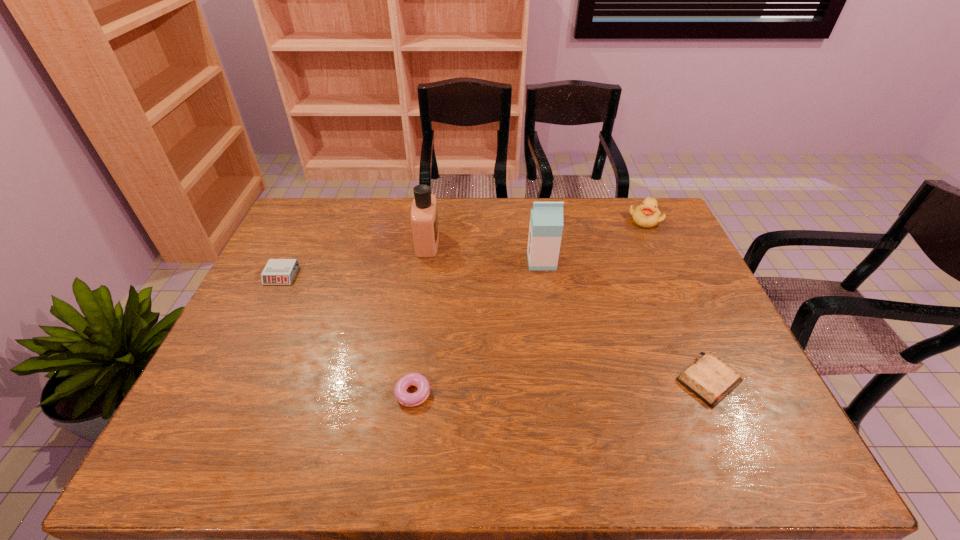
At what (x,y) coordinates should I click in order to perform the action: click on free space that satisfies the following two spatial constraints: 1. on the front label of the perfume; 2. on the left side of the fourth object from left to right. Please return your answer as a coordinate pair (x, y). The image size is (960, 540). Looking at the image, I should click on (425, 261).

Image resolution: width=960 pixels, height=540 pixels. What are the coordinates of `vacant space that satisfies the following two spatial constraints: 1. on the front label of the perfume; 2. on the left side of the diary` in the screenshot? It's located at (408, 380).

The width and height of the screenshot is (960, 540). I want to click on vacant region that satisfies the following two spatial constraints: 1. on the back side of the diary; 2. on the front label of the perfume, so click(648, 243).

Where is `free location that satisfies the following two spatial constraints: 1. on the front-facing side of the farthest object; 2. on the front label of the perfume`? The width and height of the screenshot is (960, 540). free location that satisfies the following two spatial constraints: 1. on the front-facing side of the farthest object; 2. on the front label of the perfume is located at coordinates (656, 243).

Where is `vacant space that satisfies the following two spatial constraints: 1. on the back side of the doughnut; 2. on the front label of the perfume`? The image size is (960, 540). vacant space that satisfies the following two spatial constraints: 1. on the back side of the doughnut; 2. on the front label of the perfume is located at coordinates (434, 243).

Image resolution: width=960 pixels, height=540 pixels. In order to click on free point that satisfies the following two spatial constraints: 1. on the back side of the doughnut; 2. on the right side of the shortest object in this screenshot , I will do `click(418, 380)`.